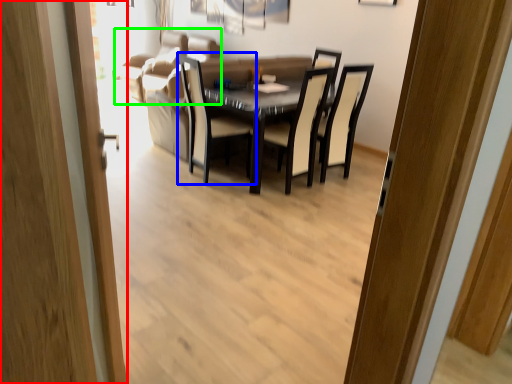
Question: Based on their relative distances, which object is farther from door (highlighted by a red box)? Choose from chair (highlighted by a blue box) and couch (highlighted by a green box).

Choices:
 (A) chair
 (B) couch

Answer: (B)